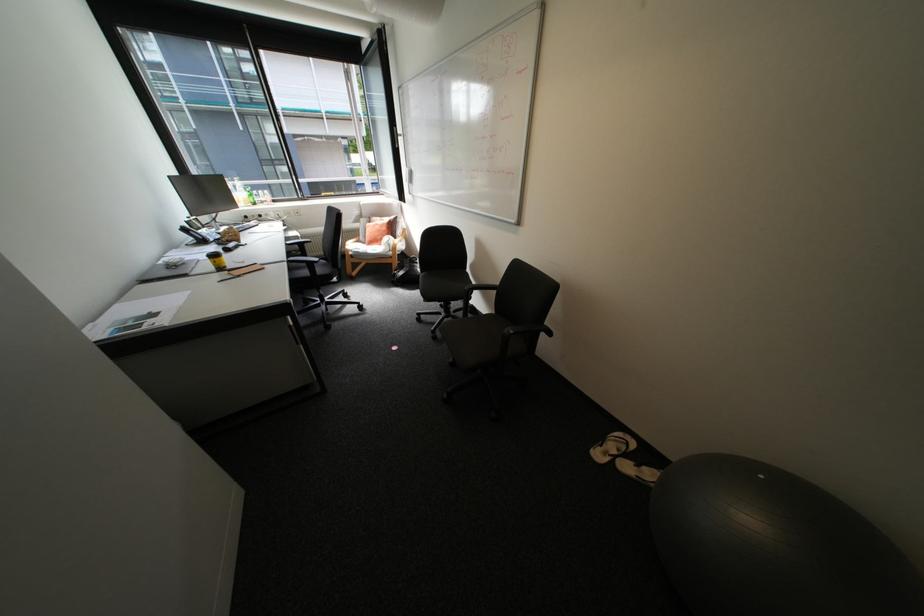
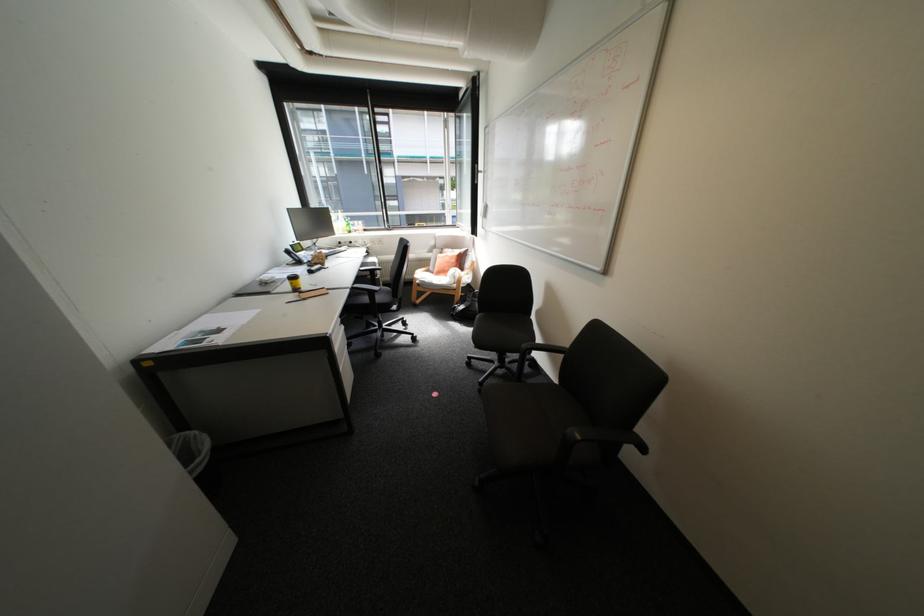
Question: The camera is either moving clockwise (left) or counter-clockwise (right) around the object. The first image is from the beginning of the video and the second image is from the end. Is the camera moving left or right when shooting the video?

Choices:
 (A) Left
 (B) Right

Answer: (B)